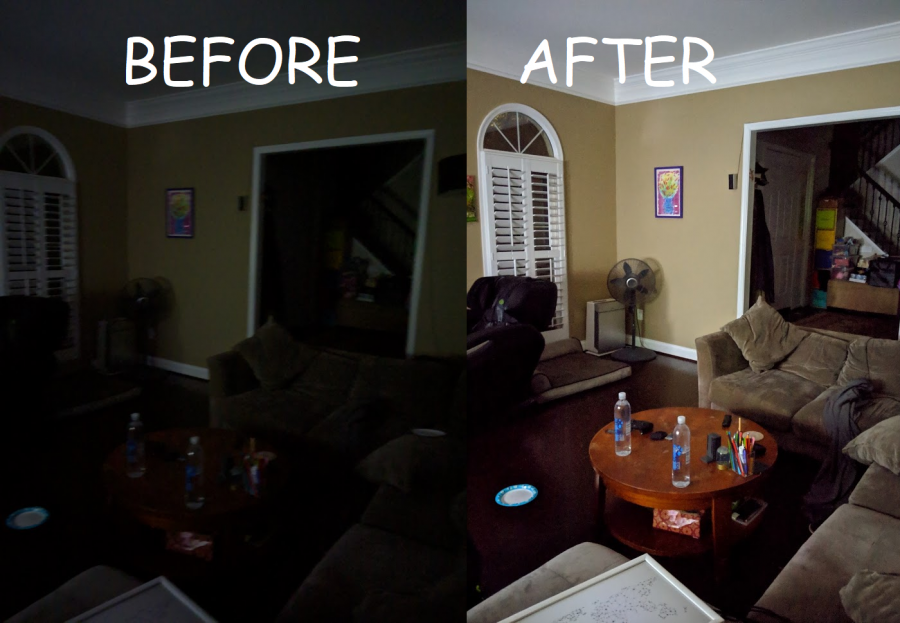
You are a GUI agent. You are given a task and a screenshot of the screen. Output one action in this format:
    pyautogui.click(x=<x>, y=<y>)
    Task: Click on the light room
    This screenshot has width=900, height=623.
    Given the screenshot: What is the action you would take?
    pyautogui.click(x=690, y=121)